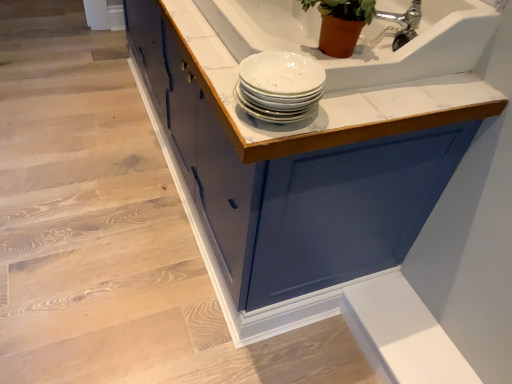
At what (x,y) coordinates should I click in order to perform the action: click on vacant space in front of silver metallic faucet at upper right. Please return your answer as a coordinate pair (x, y). Image resolution: width=512 pixels, height=384 pixels. Looking at the image, I should click on (401, 94).